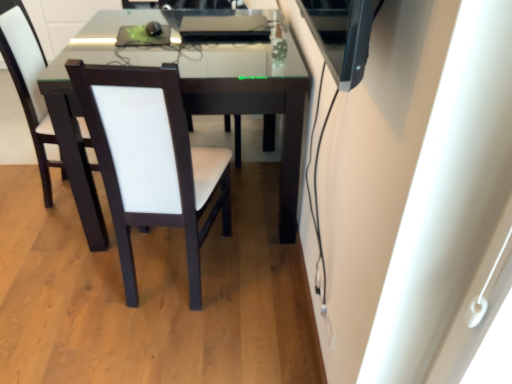
Locate an element on the screen. free location in front of white leather chair at center, the 2th chair in the left-to-right sequence is located at coordinates (153, 340).